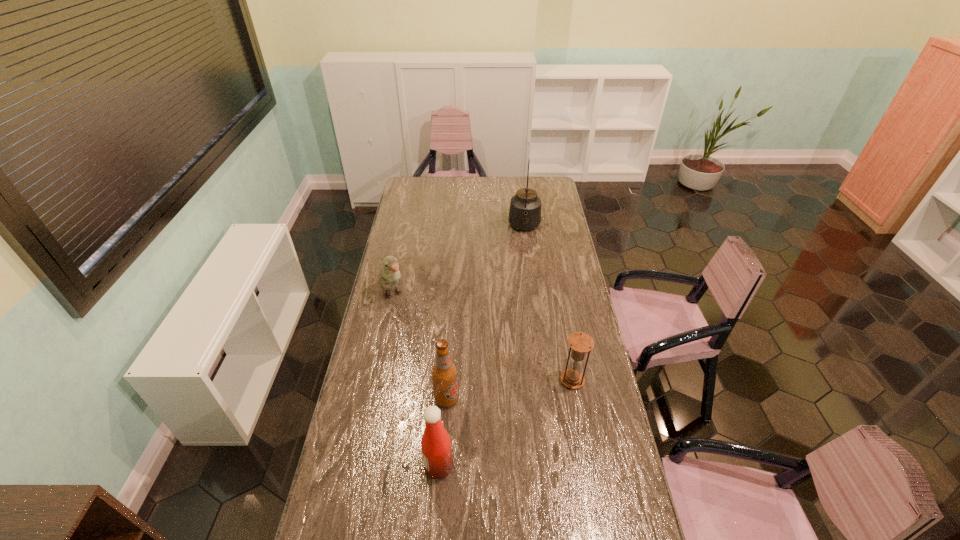
Where is `blank area in the image that satisfies the following two spatial constraints: 1. on the front side of the nearest object; 2. on the front-facing side of the second farthest object`? Image resolution: width=960 pixels, height=540 pixels. blank area in the image that satisfies the following two spatial constraints: 1. on the front side of the nearest object; 2. on the front-facing side of the second farthest object is located at coordinates (356, 466).

You are a GUI agent. You are given a task and a screenshot of the screen. Output one action in this format:
    pyautogui.click(x=<x>, y=<y>)
    Task: Click on the vacant space that satisfies the following two spatial constraints: 1. on the front side of the kettle; 2. on the right side of the hourglass
    The height and width of the screenshot is (540, 960).
    Given the screenshot: What is the action you would take?
    pyautogui.click(x=544, y=380)

Find the location of a particular element. The image size is (960, 540). vacant region that satisfies the following two spatial constraints: 1. on the front side of the hourglass; 2. on the left side of the farthest object is located at coordinates (544, 380).

Identify the location of vacant area that satisfies the following two spatial constraints: 1. on the front side of the hourglass; 2. on the left side of the tallest object. (544, 380).

Where is `vacant region that satisfies the following two spatial constraints: 1. on the front side of the kettle; 2. on the right side of the hourglass`? vacant region that satisfies the following two spatial constraints: 1. on the front side of the kettle; 2. on the right side of the hourglass is located at coordinates (544, 380).